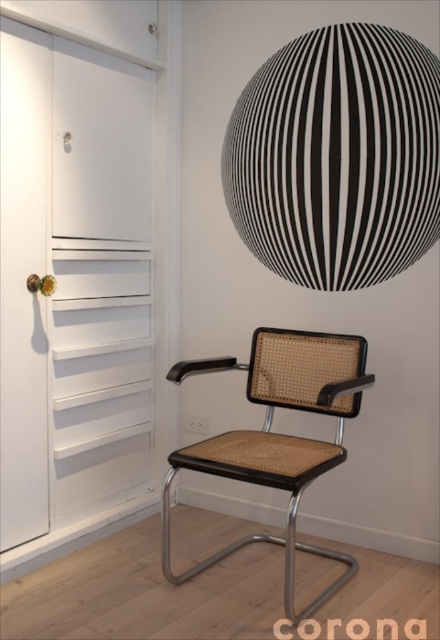
Who is shorter, white matte door at left or brown cane swivel chair at center?

brown cane swivel chair at center is shorter.

Who is lower down, white matte door at left or brown cane swivel chair at center?

brown cane swivel chair at center

Between point (135, 122) and point (321, 368), which one is positioned in front?

Positioned in front is point (321, 368).

Identify the location of white matte door at left. The width and height of the screenshot is (440, 640). (99, 280).

Is white matte door at left below white glossy door at left?

Incorrect, white matte door at left is not positioned below white glossy door at left.

Can you confirm if white matte door at left is positioned to the right of white glossy door at left?

Yes, white matte door at left is to the right of white glossy door at left.

Based on the photo, measure the distance between white matte door at left and camera.

A distance of 7.10 feet exists between white matte door at left and camera.

Locate an element on the screen. The image size is (440, 640). white matte door at left is located at coordinates (99, 280).

Is white glossy door at left shorter than brown cane swivel chair at center?

In fact, white glossy door at left may be taller than brown cane swivel chair at center.

Who is lower down, white glossy door at left or brown cane swivel chair at center?

brown cane swivel chair at center is below.

Is point (0, 428) behind point (318, 452)?

That is True.

This screenshot has width=440, height=640. I want to click on white glossy door at left, so click(x=24, y=280).